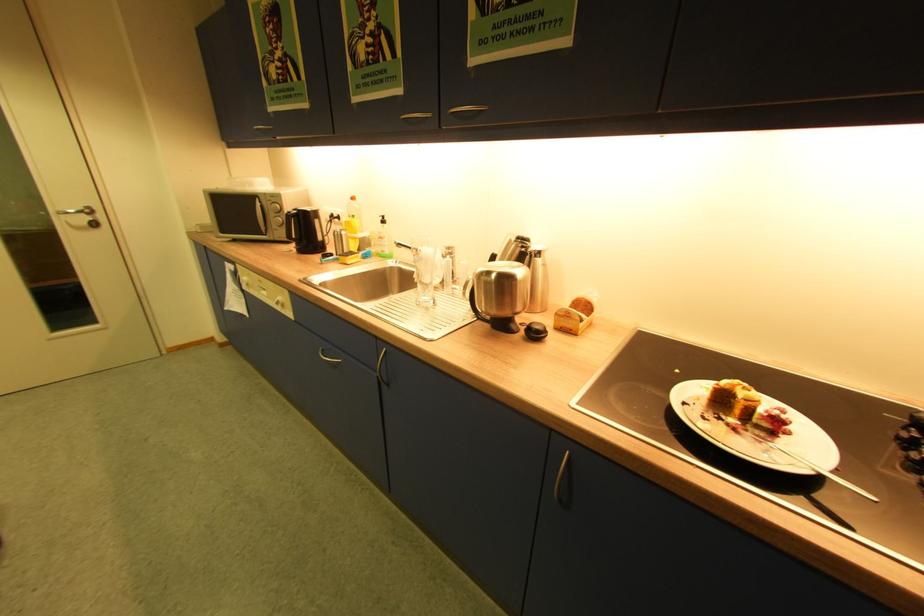
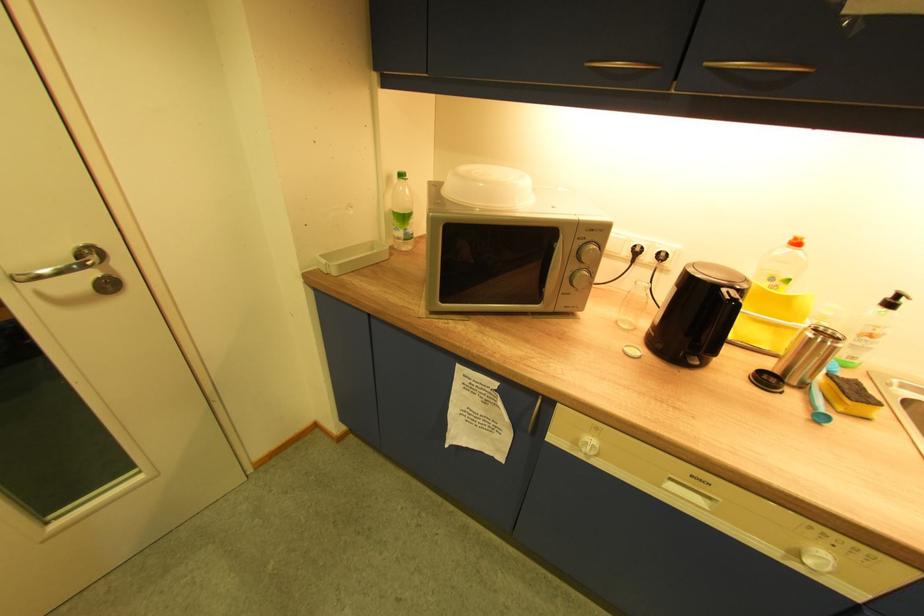
The images are taken continuously from a first-person perspective. In which direction are you moving?

The movement direction of the cameraman is left, forward.